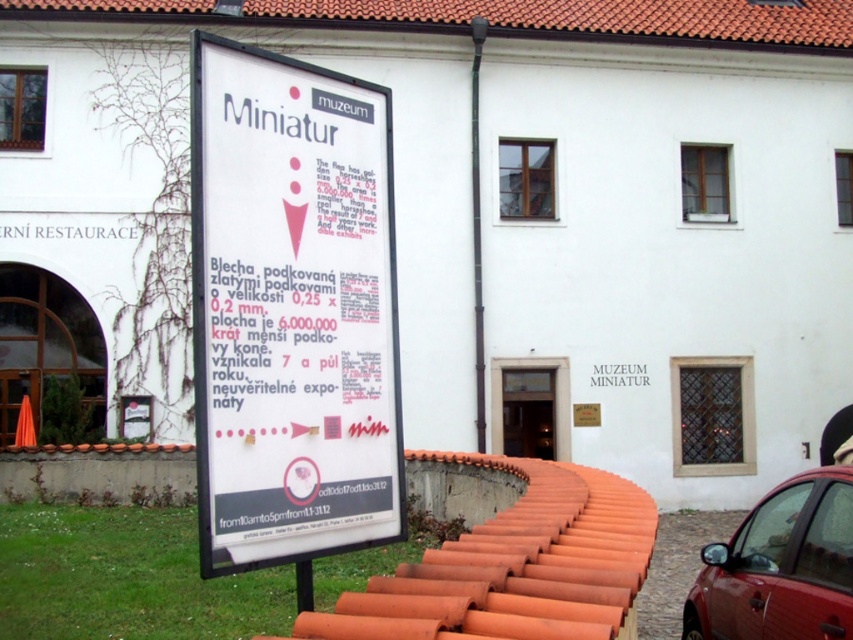
Question: Is white paper sign at center further to camera compared to shiny red car at lower right?

Choices:
 (A) no
 (B) yes

Answer: (A)

Question: Is white paper sign at center smaller than shiny red car at lower right?

Choices:
 (A) yes
 (B) no

Answer: (B)

Question: Is white paper sign at center wider than shiny red car at lower right?

Choices:
 (A) no
 (B) yes

Answer: (B)

Question: Among these points, which one is farthest from the camera?

Choices:
 (A) (840, 563)
 (B) (207, 272)

Answer: (A)